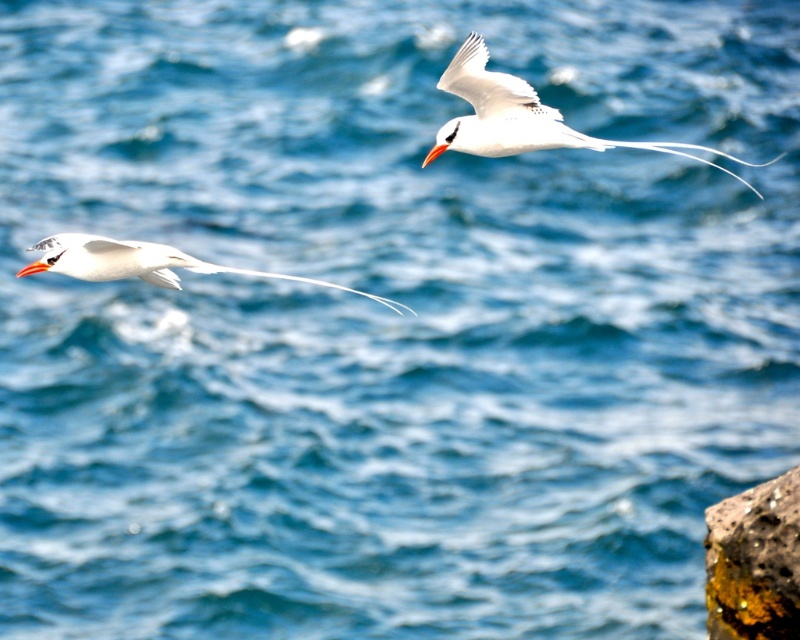
Question: Is rusty stone at lower right below white glossy bird at left?

Choices:
 (A) yes
 (B) no

Answer: (A)

Question: Is rusty stone at lower right to the right of white glossy bird at left from the viewer's perspective?

Choices:
 (A) no
 (B) yes

Answer: (B)

Question: Which is nearer to the rusty stone at lower right?

Choices:
 (A) orange glossy beak at upper left
 (B) orange glossy beak at upper right
 (C) white glossy bird at left
 (D) white glossy bird at upper right

Answer: (D)

Question: Is orange glossy beak at upper left to the left of orange glossy beak at upper right from the viewer's perspective?

Choices:
 (A) yes
 (B) no

Answer: (A)

Question: Which of the following is the closest to the observer?

Choices:
 (A) orange glossy beak at upper right
 (B) rusty stone at lower right
 (C) orange glossy beak at upper left

Answer: (C)

Question: Which object is the closest to the orange glossy beak at upper right?

Choices:
 (A) orange glossy beak at upper left
 (B) white glossy bird at upper right

Answer: (B)